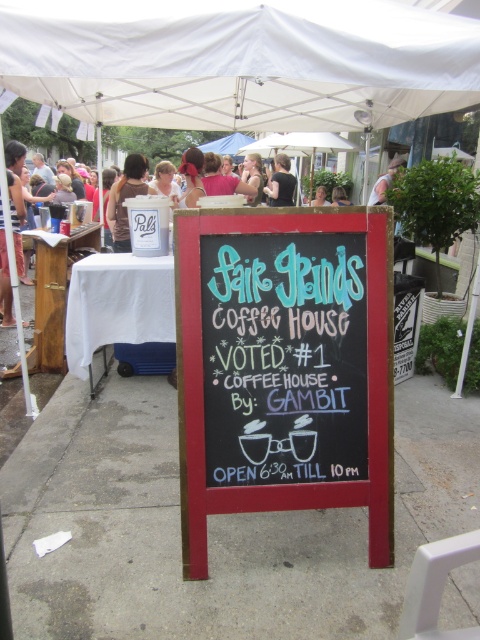
Is chalkboard sign at center positioned before matte white cup at center?

Yes, chalkboard sign at center is in front of matte white cup at center.

Between chalkboard sign at center and matte white cup at center, which one appears on the left side from the viewer's perspective?

Positioned to the left is matte white cup at center.

Image resolution: width=480 pixels, height=640 pixels. I want to click on chalkboard sign at center, so 284,356.

Locate an element on the screen. chalkboard sign at center is located at coordinates (284, 356).

Consider the image. Does chalkboard sign at center have a lesser width compared to matte white shirt at center?

No, chalkboard sign at center is not thinner than matte white shirt at center.

Find the location of a particular element. chalkboard sign at center is located at coordinates (284, 356).

The height and width of the screenshot is (640, 480). In order to click on chalkboard sign at center in this screenshot , I will do `click(284, 356)`.

Measure the distance between concrete at center and matte white shirt at center.

concrete at center is 5.71 meters away from matte white shirt at center.

Consider the image. Between concrete at center and matte white shirt at center, which one appears on the right side from the viewer's perspective?

Positioned to the right is concrete at center.

Between point (76, 486) and point (173, 196), which one is positioned in front?

Positioned in front is point (76, 486).

Image resolution: width=480 pixels, height=640 pixels. Identify the location of concrete at center. (213, 525).